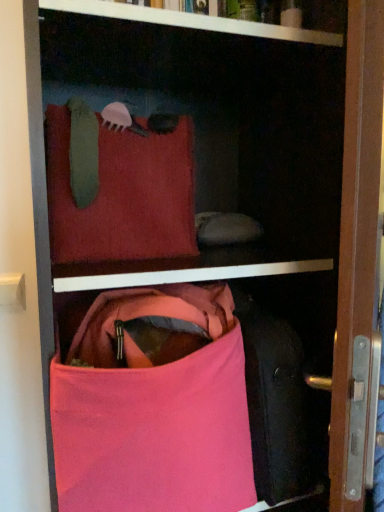
Question: Does pink fabric handbag at lower center have a lesser height compared to velvet red pillow at upper center?

Choices:
 (A) no
 (B) yes

Answer: (A)

Question: Can you confirm if pink fabric handbag at lower center is positioned to the left of velvet red pillow at upper center?

Choices:
 (A) yes
 (B) no

Answer: (B)

Question: From the image's perspective, is pink fabric handbag at lower center over velvet red pillow at upper center?

Choices:
 (A) yes
 (B) no

Answer: (B)

Question: Does pink fabric handbag at lower center have a greater height compared to velvet red pillow at upper center?

Choices:
 (A) no
 (B) yes

Answer: (B)

Question: Are pink fabric handbag at lower center and velvet red pillow at upper center far apart?

Choices:
 (A) yes
 (B) no

Answer: (B)

Question: From the image's perspective, is pink fabric handbag at lower center beneath velvet red pillow at upper center?

Choices:
 (A) no
 (B) yes

Answer: (B)

Question: From a real-world perspective, is velvet red pillow at upper center physically below pink fabric handbag at lower center?

Choices:
 (A) yes
 (B) no

Answer: (B)

Question: Does velvet red pillow at upper center have a larger size compared to pink fabric handbag at lower center?

Choices:
 (A) yes
 (B) no

Answer: (B)

Question: From the image's perspective, does velvet red pillow at upper center appear lower than pink fabric handbag at lower center?

Choices:
 (A) yes
 (B) no

Answer: (B)

Question: From the image's perspective, is velvet red pillow at upper center over pink fabric handbag at lower center?

Choices:
 (A) no
 (B) yes

Answer: (B)

Question: Are velvet red pillow at upper center and pink fabric handbag at lower center beside each other?

Choices:
 (A) yes
 (B) no

Answer: (B)

Question: Can pink fabric handbag at lower center be found inside velvet red pillow at upper center?

Choices:
 (A) yes
 (B) no

Answer: (B)

Question: From the image's perspective, is pink fabric handbag at lower center positioned above or below velvet red pillow at upper center?

Choices:
 (A) above
 (B) below

Answer: (B)